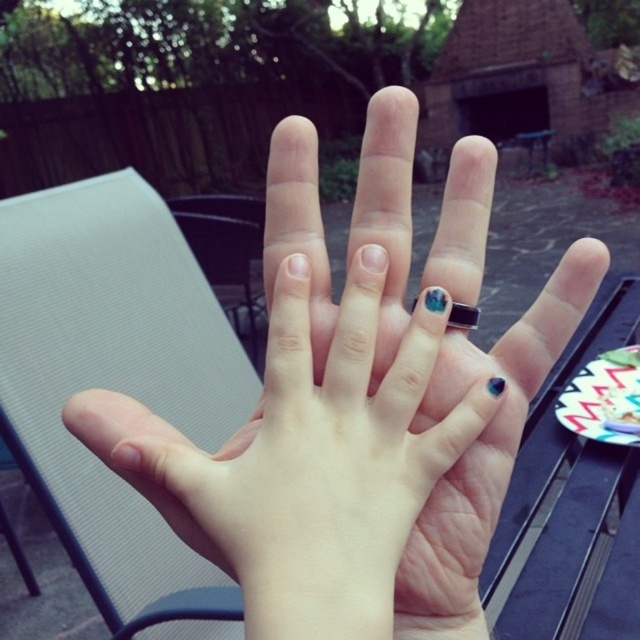
Question: Does nail polish at center come behind blue gemstone ring at center?

Choices:
 (A) no
 (B) yes

Answer: (A)

Question: Does nail polish at center have a larger size compared to blue gemstone ring at center?

Choices:
 (A) yes
 (B) no

Answer: (A)

Question: Which point appears closest to the camera in this image?

Choices:
 (A) (464, 307)
 (B) (444, 460)

Answer: (B)

Question: Which of the following is the closest to the observer?

Choices:
 (A) (467, 317)
 (B) (216, 525)

Answer: (B)

Question: Which point is closer to the camera?

Choices:
 (A) blue gemstone ring at center
 (B) nail polish at center

Answer: (B)

Question: Is nail polish at center to the right of blue gemstone ring at center from the viewer's perspective?

Choices:
 (A) no
 (B) yes

Answer: (A)